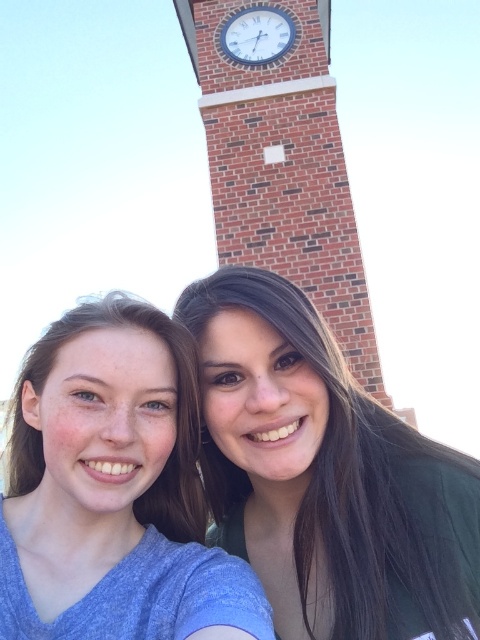
Can you confirm if matte blue shirt at lower left is positioned to the right of white glossy clock at upper center?

No, matte blue shirt at lower left is not to the right of white glossy clock at upper center.

Can you confirm if matte blue shirt at lower left is positioned to the left of white glossy clock at upper center?

Yes, matte blue shirt at lower left is to the left of white glossy clock at upper center.

Find the location of `matte blue shirt at lower left`. matte blue shirt at lower left is located at coordinates (113, 490).

You are a GUI agent. You are given a task and a screenshot of the screen. Output one action in this format:
    pyautogui.click(x=<x>, y=<y>)
    Task: Click on the matte blue shirt at lower left
    Image resolution: width=480 pixels, height=640 pixels.
    Given the screenshot: What is the action you would take?
    pyautogui.click(x=113, y=490)

Between matte green shirt at lower right and white glossy clock at upper center, which one is positioned lower?

matte green shirt at lower right is lower down.

This screenshot has height=640, width=480. What do you see at coordinates (325, 476) in the screenshot?
I see `matte green shirt at lower right` at bounding box center [325, 476].

This screenshot has height=640, width=480. Describe the element at coordinates (325, 476) in the screenshot. I see `matte green shirt at lower right` at that location.

Find the location of a particular element. matte green shirt at lower right is located at coordinates tap(325, 476).

This screenshot has width=480, height=640. Describe the element at coordinates (283, 164) in the screenshot. I see `brick clock tower at center` at that location.

Who is higher up, brick clock tower at center or white glossy clock at upper center?

white glossy clock at upper center is above.

This screenshot has height=640, width=480. What do you see at coordinates (283, 164) in the screenshot?
I see `brick clock tower at center` at bounding box center [283, 164].

You are a GUI agent. You are given a task and a screenshot of the screen. Output one action in this format:
    pyautogui.click(x=<x>, y=<y>)
    Task: Click on the brick clock tower at center
    This screenshot has height=640, width=480.
    Given the screenshot: What is the action you would take?
    pyautogui.click(x=283, y=164)